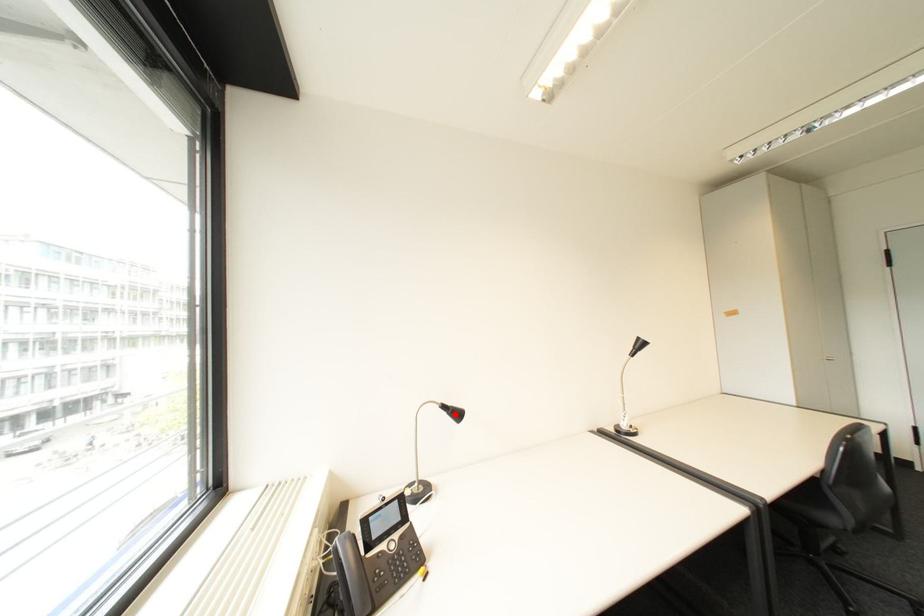
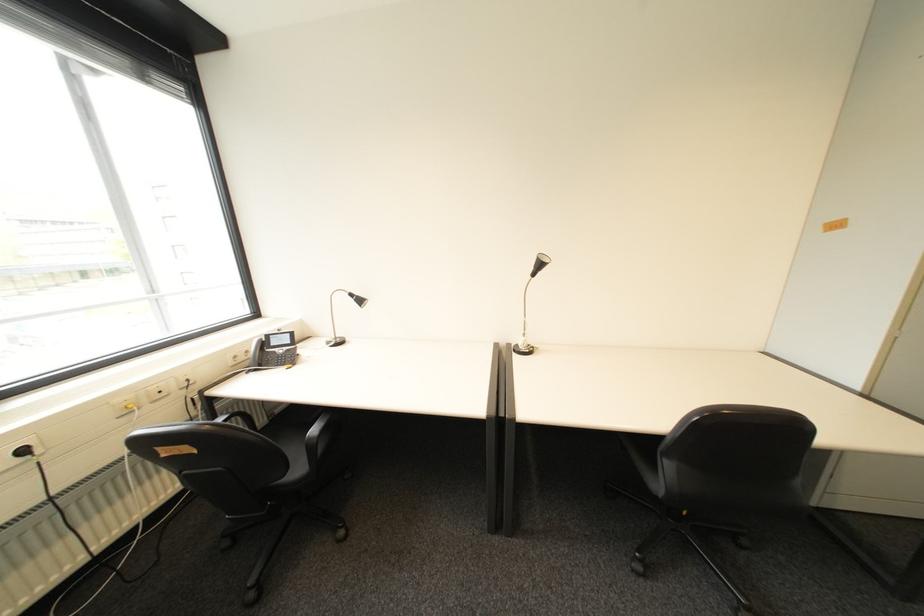
The point at the highlighted location is marked in the first image. Where is the corresponding point in the second image?

(362, 301)